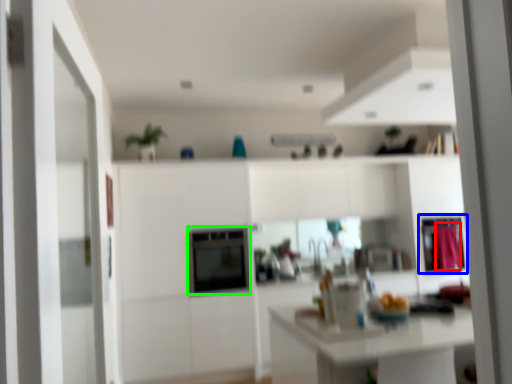
Question: Which object is the farthest from curtain (highlighted by a red box)? Choose among these: cabinetry (highlighted by a blue box) or appliance (highlighted by a green box).

Choices:
 (A) cabinetry
 (B) appliance

Answer: (B)